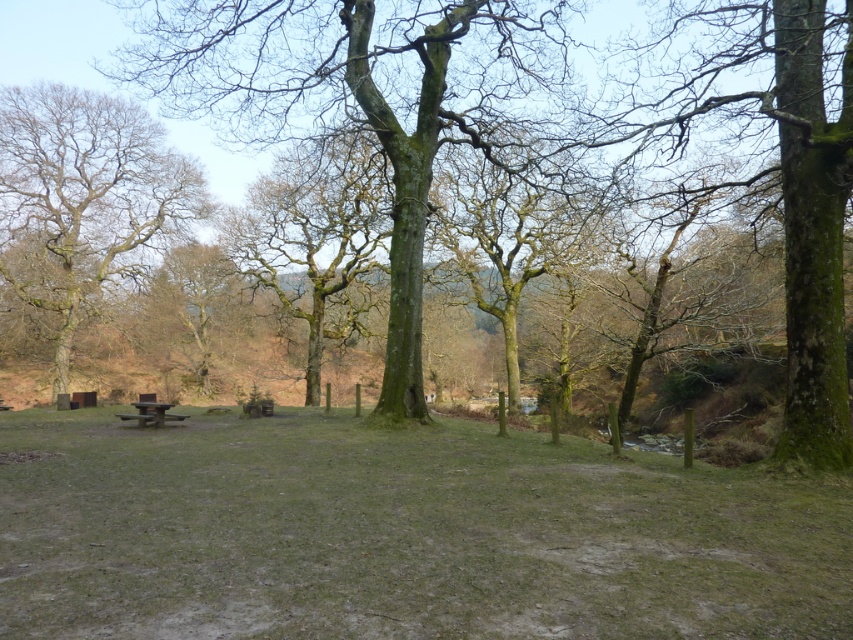
Between green mossy tree at left and wooden picnic table at lower left, which one has more height?

Standing taller between the two is green mossy tree at left.

Measure the distance between green mossy tree at left and wooden picnic table at lower left.

green mossy tree at left and wooden picnic table at lower left are 60.55 feet apart from each other.

Who is more forward, (91,304) or (165,408)?

Point (165,408) is in front.

Identify the location of green mossy tree at left. (83, 198).

Is green grassy field at center taller than green mossy tree at center?

Incorrect, green grassy field at center's height is not larger of green mossy tree at center's.

Who is more distant from viewer, (363, 604) or (132, 74)?

Positioned behind is point (132, 74).

Is point (590, 452) behind point (505, 36)?

No, it is in front of (505, 36).

This screenshot has height=640, width=853. I want to click on green grassy field at center, so pyautogui.click(x=399, y=532).

Can you confirm if wooden picnic table at lower left is smaller than wooden park bench at center?

Actually, wooden picnic table at lower left might be larger than wooden park bench at center.

Locate an element on the screen. wooden picnic table at lower left is located at coordinates (151, 413).

You are a GUI agent. You are given a task and a screenshot of the screen. Output one action in this format:
    pyautogui.click(x=<x>, y=<y>)
    Task: Click on the wooden picnic table at lower left
    This screenshot has height=640, width=853.
    Given the screenshot: What is the action you would take?
    click(x=151, y=413)